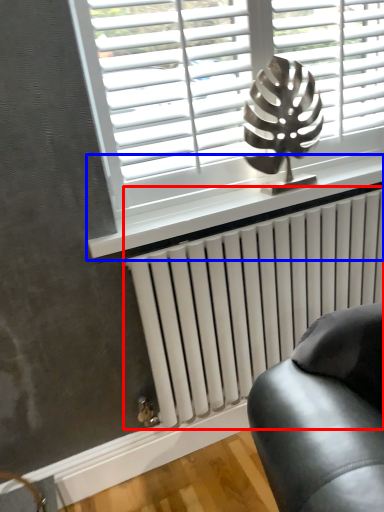
Question: Which point is further to the camera, radiator (highlighted by a red box) or window sill (highlighted by a blue box)?

Choices:
 (A) radiator
 (B) window sill

Answer: (A)